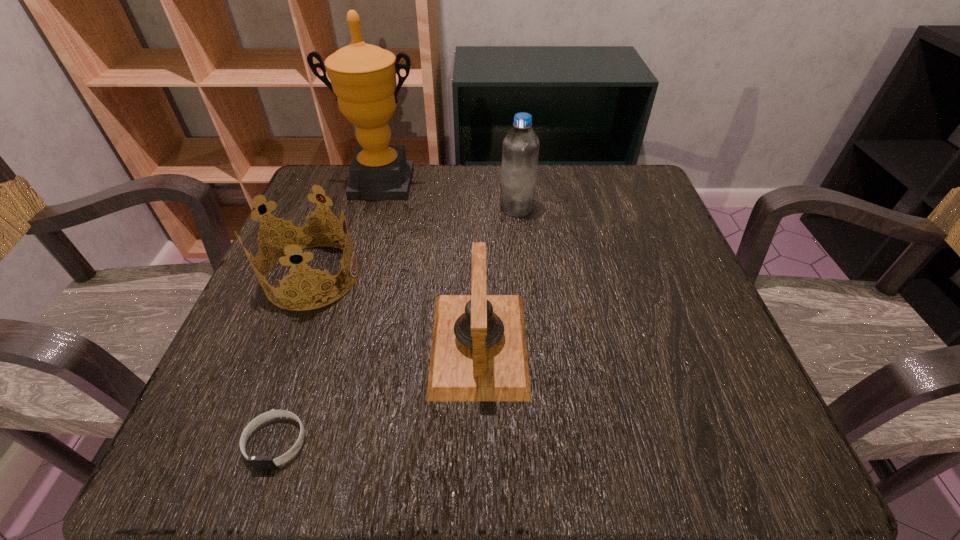
At what (x,y) coordinates should I click in order to perform the action: click on award. Please return your answer as a coordinate pair (x, y). This screenshot has width=960, height=540. Looking at the image, I should click on (363, 77).

The image size is (960, 540). I want to click on water bottle, so click(x=520, y=151).

You are a GUI agent. You are given a task and a screenshot of the screen. Output one action in this format:
    pyautogui.click(x=<x>, y=<y>)
    Task: Click on the crown
    
    Given the screenshot: What is the action you would take?
    pyautogui.click(x=296, y=237)

This screenshot has height=540, width=960. I want to click on bell, so click(x=479, y=353).

Image resolution: width=960 pixels, height=540 pixels. Identify the location of the shortest object. (257, 462).

Identify the location of wristband. (257, 462).

This screenshot has width=960, height=540. What are the coordinates of `free spot located 0.300m at the front of the tallest object with handles` in the screenshot? It's located at (348, 298).

Where is `free space located 0.250m on the left of the water bottle`? The height and width of the screenshot is (540, 960). free space located 0.250m on the left of the water bottle is located at coordinates (388, 207).

Where is `free space located 0.270m on the right of the crown`? This screenshot has width=960, height=540. free space located 0.270m on the right of the crown is located at coordinates (501, 276).

Where is `vacant space situated 0.080m on the right of the bell`? vacant space situated 0.080m on the right of the bell is located at coordinates (576, 344).